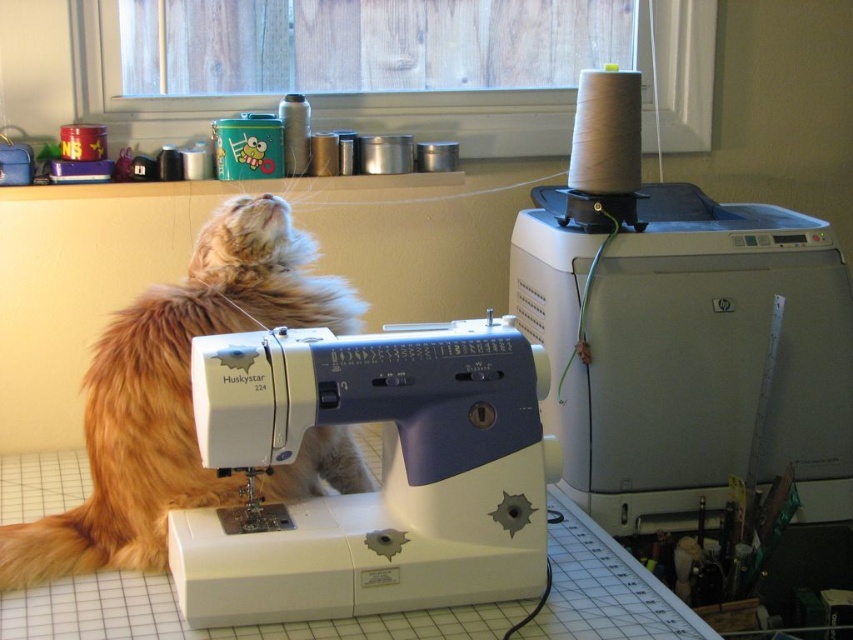
Is point (549, 410) less distant than point (463, 502)?

That is False.

Between matte gray printer at upper right and white plastic sewing machine at center, which one appears on the left side from the viewer's perspective?

From the viewer's perspective, white plastic sewing machine at center appears more on the left side.

Identify the location of matte gray printer at upper right. Image resolution: width=853 pixels, height=640 pixels. (680, 332).

Find the location of a particular element. matte gray printer at upper right is located at coordinates [680, 332].

Can you confirm if matte gray printer at upper right is positioned to the right of fuzzy orange cat at upper left?

Indeed, matte gray printer at upper right is positioned on the right side of fuzzy orange cat at upper left.

Who is more forward, (616, 426) or (331, 307)?

Positioned in front is point (331, 307).

What are the coordinates of `matte gray printer at upper right` in the screenshot? It's located at (680, 332).

Based on the photo, which of these two, white plastic sewing machine at center or fuzzy orange cat at upper left, stands taller?

Standing taller between the two is fuzzy orange cat at upper left.

What do you see at coordinates (383, 474) in the screenshot? I see `white plastic sewing machine at center` at bounding box center [383, 474].

I want to click on white plastic sewing machine at center, so click(383, 474).